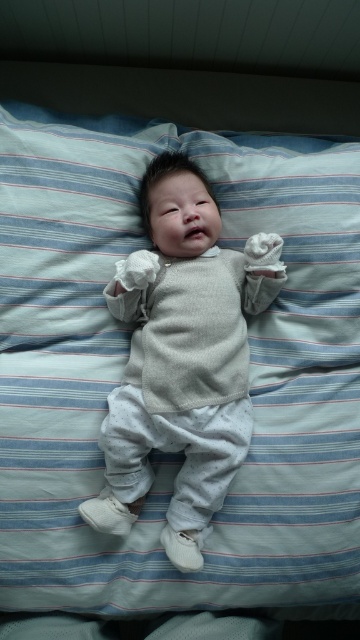
Question: Which of the following is the closest to the observer?

Choices:
 (A) light gray knit sweater at center
 (B) light blue striped pillow at center

Answer: (A)

Question: In this image, where is light blue striped pillow at center located relative to light gray knit sweater at center?

Choices:
 (A) right
 (B) left

Answer: (B)

Question: Is light blue striped pillow at center smaller than light gray knit sweater at center?

Choices:
 (A) yes
 (B) no

Answer: (B)

Question: Does light blue striped pillow at center have a smaller size compared to light gray knit sweater at center?

Choices:
 (A) no
 (B) yes

Answer: (A)

Question: Which point is farther from the camera taking this photo?

Choices:
 (A) (128, 468)
 (B) (345, 314)

Answer: (B)